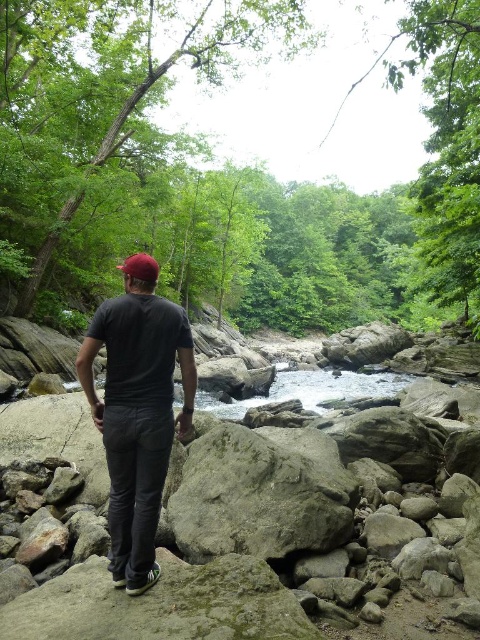
Is dark gray cotton t-shirt at center positioned before red matte cap at center?

That is True.

Between dark gray cotton t-shirt at center and red matte cap at center, which one is positioned lower?

dark gray cotton t-shirt at center is lower down.

Is point (134, 541) closer to camera compared to point (148, 257)?

That is True.

Where is `dark gray cotton t-shirt at center`? The width and height of the screenshot is (480, 640). dark gray cotton t-shirt at center is located at coordinates (136, 417).